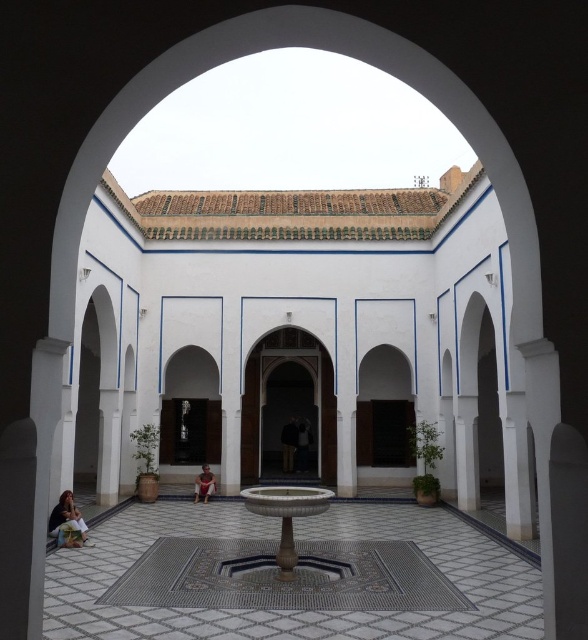
Is brown leather jacket at center above matte white person at center?

No.

Which is behind, point (296, 444) or point (213, 490)?

Point (296, 444)

Where is `brown leather jacket at center`? This screenshot has width=588, height=640. brown leather jacket at center is located at coordinates (288, 444).

Looking at this image, is white mosaic fountain at center thinner than matte white person at center?

No, white mosaic fountain at center is not thinner than matte white person at center.

Is point (345, 611) less distant than point (193, 497)?

Yes.

The image size is (588, 640). I want to click on white mosaic fountain at center, so click(294, 611).

Is marble fountain at center below matte white person at center?

No, marble fountain at center is not below matte white person at center.

Is marble fountain at center taller than matte white person at center?

Indeed, marble fountain at center has a greater height compared to matte white person at center.

Image resolution: width=588 pixels, height=640 pixels. In order to click on marble fountain at center in this screenshot , I will do (286, 515).

The image size is (588, 640). I want to click on marble fountain at center, so click(286, 515).